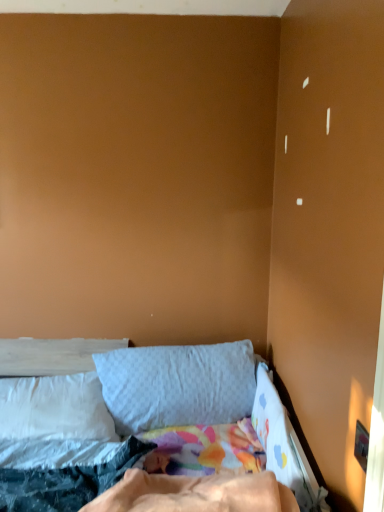
Question: From the image's perspective, is gray fabric pillow at center, acting as the first pillow starting from the right, above or below soft cotton bed at lower left?

Choices:
 (A) below
 (B) above

Answer: (B)

Question: Considering the positions of point (122, 391) and point (314, 490), is point (122, 391) closer or farther from the camera than point (314, 490)?

Choices:
 (A) farther
 (B) closer

Answer: (A)

Question: Which object is the closest to the soft cotton bed at lower left?

Choices:
 (A) gray fabric pillow at center, acting as the first pillow starting from the right
 (B) white soft pillow at left, the 2th pillow when ordered from right to left

Answer: (B)

Question: Considering the real-world distances, which object is farthest from the soft cotton bed at lower left?

Choices:
 (A) white soft pillow at left, the 2th pillow when ordered from right to left
 (B) gray fabric pillow at center, acting as the first pillow starting from the right

Answer: (B)